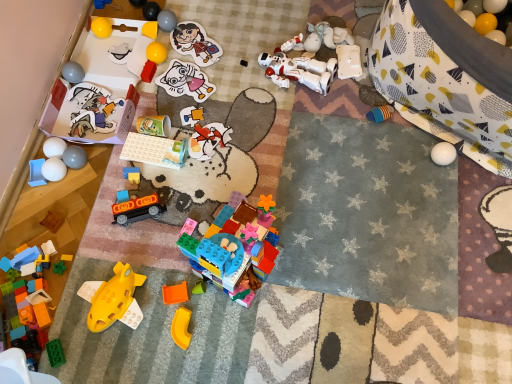
You are a GUI agent. You are given a task and a screenshot of the screen. Output one action in this format:
    pyautogui.click(x=<x>, y=<y>)
    Task: Click on the vacant space in between matte paper sticker at upper center, which is counted as the twentieth toy, starting from the left, and white matte robot at upper center, the 3th toy viewed from the right
    
    Given the screenshot: What is the action you would take?
    pyautogui.click(x=237, y=58)